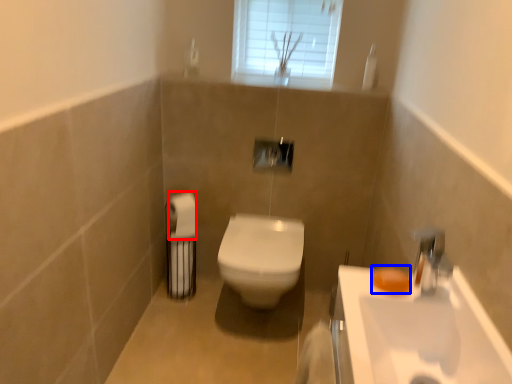
Question: Which object is closer to the camera taking this photo, toilet paper (highlighted by a red box) or soap (highlighted by a blue box)?

Choices:
 (A) toilet paper
 (B) soap

Answer: (B)